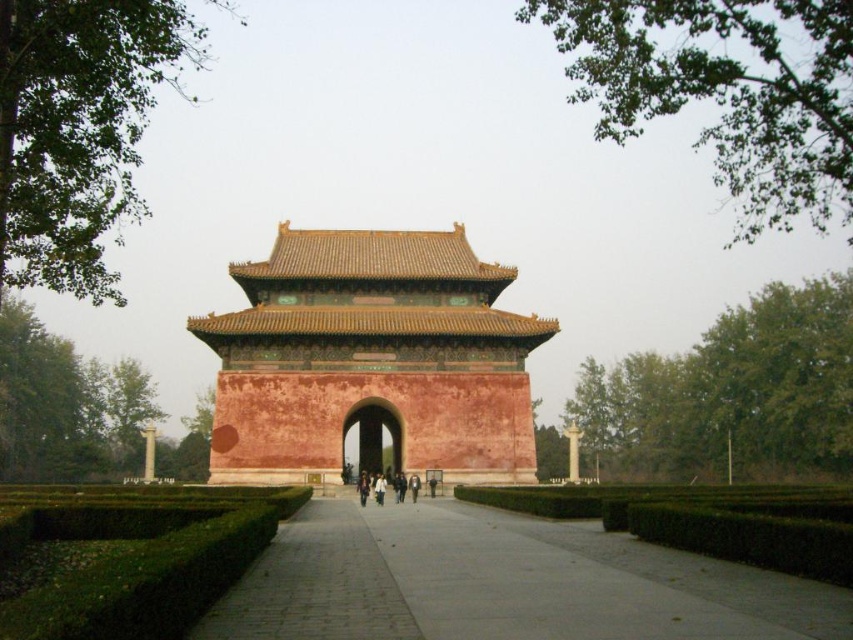
Question: Is green hedge at center above brown leather jacket at center?

Choices:
 (A) yes
 (B) no

Answer: (A)

Question: Among these objects, which one is farthest from the camera?

Choices:
 (A) green hedge at center
 (B) reddish-brown stone temple at center
 (C) white matte jacket at center
 (D) brown leather jacket at center

Answer: (B)

Question: Which point is farther to the camera?

Choices:
 (A) (339, 586)
 (B) (485, 358)
 (C) (361, 472)
 (D) (378, 476)

Answer: (B)

Question: Is paved stone path at center above white matte jacket at center?

Choices:
 (A) no
 (B) yes

Answer: (B)

Question: Which of the following is the farthest from the observer?

Choices:
 (A) (489, 406)
 (B) (357, 568)
 (C) (375, 490)

Answer: (A)

Question: Does reddish-brown stone temple at center appear over green hedge at center?

Choices:
 (A) no
 (B) yes

Answer: (B)